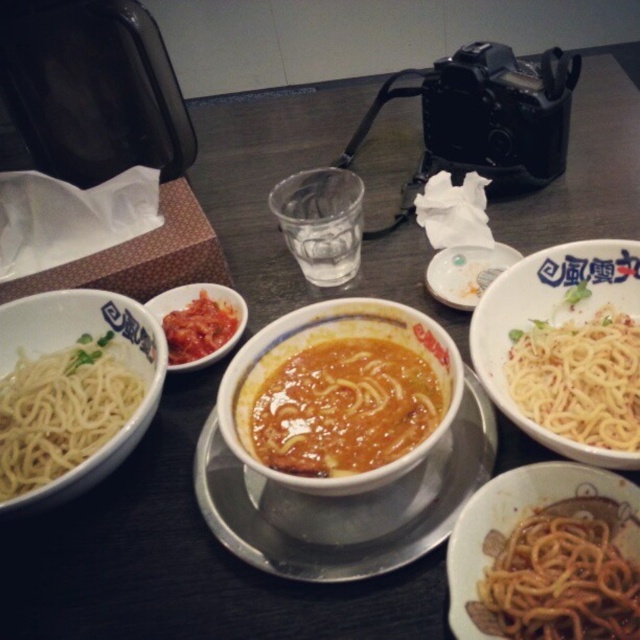
Based on the photo, you are setting up a photo shoot for a food blog and need to place two bowls on the table. The white glossy bowl at center and the matte ceramic bowl at center are both candidates. Based on their appearance, which bowl do you think has a larger diameter?

The white glossy bowl at center might be wider than matte ceramic bowl at center, so it likely has a larger diameter.